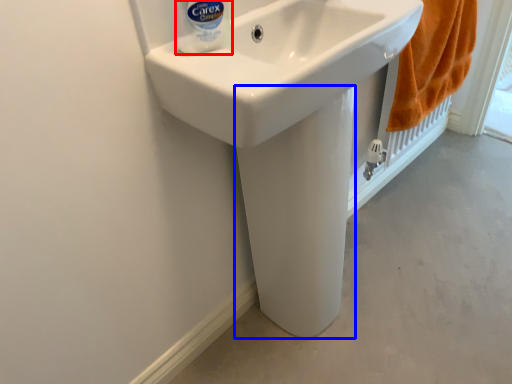
Question: Which of the following is the closest to the observer, cleaning product (highlighted by a red box) or bidet (highlighted by a blue box)?

Choices:
 (A) cleaning product
 (B) bidet

Answer: (A)